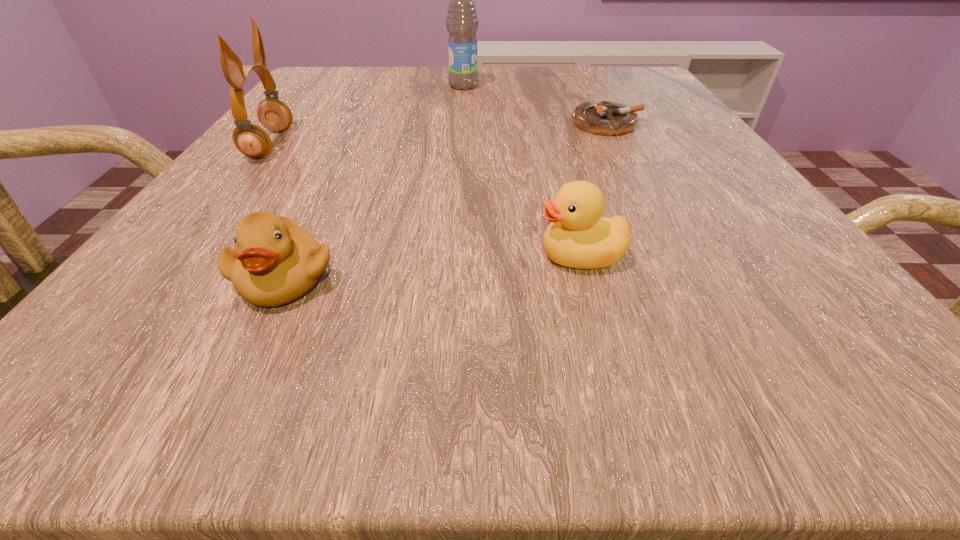
This screenshot has height=540, width=960. In order to click on vacant region located at the beak of the duck in this screenshot , I will do `click(408, 255)`.

The image size is (960, 540). In order to click on free location located at the beak of the second object from left to right in this screenshot , I will do `click(238, 371)`.

Find the location of `vacant area situated on the front of the shortest object`. vacant area situated on the front of the shortest object is located at coordinates pos(627,162).

Identify the location of object that is at the far edge. (462, 23).

Find the location of a particular element. This screenshot has height=540, width=960. earphone that is positioned at the left edge is located at coordinates (251, 140).

Identify the location of duckling at the left edge. (275, 261).

Identify the location of object at the right edge. (606, 118).

This screenshot has width=960, height=540. I want to click on free space at the far edge of the desktop, so click(496, 79).

Where is `free region at the near edge of the desktop`? The width and height of the screenshot is (960, 540). free region at the near edge of the desktop is located at coordinates (582, 340).

Identify the location of vacant point at the left edge. (x=228, y=294).